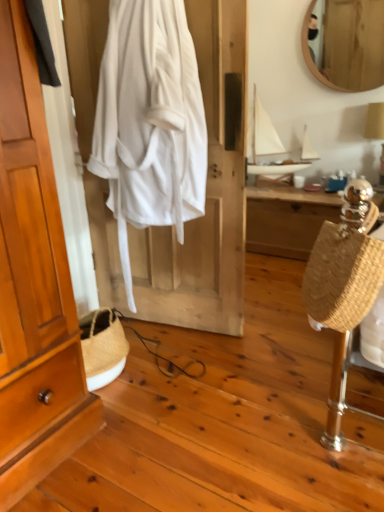
This screenshot has width=384, height=512. Describe the element at coordinates (343, 274) in the screenshot. I see `braided straw bag at right` at that location.

Measure the distance between white cotton robe at center and camera.

A distance of 5.32 feet exists between white cotton robe at center and camera.

The height and width of the screenshot is (512, 384). I want to click on wooden mirror at upper right, so click(x=350, y=45).

In order to face white matte sailboat at upper center, should I rotate leftwards or rightwards?

To face it directly, rotate right by 11.442 degrees.

What are the coordinates of `braided straw bag at right` in the screenshot? It's located at (343, 274).

Considering the sizes of objects wooden wardrobe at left and wooden mirror at upper right in the image provided, who is smaller, wooden wardrobe at left or wooden mirror at upper right?

wooden wardrobe at left.

Is wooden mirror at upper right inside wooden wardrobe at left?

That's incorrect, wooden mirror at upper right is not inside wooden wardrobe at left.

This screenshot has width=384, height=512. I want to click on cabinetry in front of the wooden mirror at upper right, so click(34, 285).

Considering the sizes of wooden desk at center and braided straw bag at right in the image, is wooden desk at center bigger or smaller than braided straw bag at right?

Considering their sizes, wooden desk at center takes up more space than braided straw bag at right.

How much distance is there between wooden desk at center and braided straw bag at right?

wooden desk at center is 1.69 meters away from braided straw bag at right.

Is wooden desk at center positioned in front of braided straw bag at right?

No, wooden desk at center is behind braided straw bag at right.

Is braided straw bag at right at the back of wooden desk at center?

No, wooden desk at center's orientation is not away from braided straw bag at right.

Considering the positions of objects wooden wardrobe at left and braided straw bag at right in the image provided, who is more to the right, wooden wardrobe at left or braided straw bag at right?

From the viewer's perspective, braided straw bag at right appears more on the right side.

Is wooden wardrobe at left not within braided straw bag at right?

Yes.

From a real-world perspective, is wooden wardrobe at left beneath braided straw bag at right?

No, from a real-world perspective, wooden wardrobe at left is not below braided straw bag at right.

Which object is closer to the camera taking this photo, wooden wardrobe at left or white cotton robe at center?

wooden wardrobe at left.

Is wooden wardrobe at left positioned far away from white cotton robe at center?

That's not correct — wooden wardrobe at left is a little close to white cotton robe at center.

In the scene shown: Is wooden wardrobe at left smaller than white cotton robe at center?

Correct, wooden wardrobe at left occupies less space than white cotton robe at center.

Is point (70, 447) positioned before point (167, 183)?

Yes, point (70, 447) is closer to viewer.

Are white matte sailboat at upper center and white cotton robe at center beside each other?

No, white matte sailboat at upper center is not touching white cotton robe at center.

Is white matte sailboat at upper center to the right of white cotton robe at center from the viewer's perspective?

Yes.

Is the position of white matte sailboat at upper center more distant than that of white cotton robe at center?

Yes, white matte sailboat at upper center is behind white cotton robe at center.

How different are the orientations of white matte sailboat at upper center and white cotton robe at center in degrees?

The angular difference between white matte sailboat at upper center and white cotton robe at center is 11.9 degrees.

Is white matte sailboat at upper center at the left side of wooden wardrobe at left?

No.

Based on their sizes in the image, would you say white matte sailboat at upper center is bigger or smaller than wooden wardrobe at left?

white matte sailboat at upper center is bigger than wooden wardrobe at left.

Which is correct: white matte sailboat at upper center is inside wooden wardrobe at left, or outside of it?

white matte sailboat at upper center is spatially situated outside wooden wardrobe at left.

Is wooden desk at center surrounding white cotton robe at center?

That's incorrect, white cotton robe at center is not inside wooden desk at center.

From the picture: Is wooden desk at center positioned with its back to white cotton robe at center?

No, wooden desk at center's orientation is not away from white cotton robe at center.

Does wooden desk at center have a greater height compared to white cotton robe at center?

Incorrect, the height of wooden desk at center is not larger of that of white cotton robe at center.

From a real-world perspective, which object rests below the other?

wooden desk at center, from a real-world perspective.

The width and height of the screenshot is (384, 512). In order to click on mirror behind the wooden wardrobe at left in this screenshot , I will do `click(350, 45)`.

In the image, there is a wooden desk at center. Find the location of `handbag below it (from the image's perspective)`. handbag below it (from the image's perspective) is located at coordinates (343, 274).

Considering their positions, is wooden mirror at upper right positioned further to wooden desk at center than braided straw bag at right?

braided straw bag at right is further to wooden desk at center.

Estimate the real-world distances between objects in this image. Which object is closer to white matte sailboat at upper center, wooden mirror at upper right or white cotton robe at center?

Based on the image, wooden mirror at upper right appears to be nearer to white matte sailboat at upper center.

Looking at the image, which one is located further to white cotton robe at center, white matte sailboat at upper center or braided straw bag at right?

The object further to white cotton robe at center is white matte sailboat at upper center.

Considering their positions, is white matte sailboat at upper center positioned further to wooden mirror at upper right than wooden wardrobe at left?

wooden wardrobe at left.

From the image, which object appears to be nearer to wooden wardrobe at left, white matte sailboat at upper center or wooden desk at center?

Based on the image, wooden desk at center appears to be nearer to wooden wardrobe at left.

Based on the photo, estimate the real-world distances between objects in this image. Which object is closer to wooden wardrobe at left, wooden desk at center or white cotton robe at center?

white cotton robe at center lies closer to wooden wardrobe at left than the other object.

Based on their spatial positions, is braided straw bag at right or wooden desk at center further from wooden wardrobe at left?

Among the two, wooden desk at center is located further to wooden wardrobe at left.

When comparing their distances from wooden wardrobe at left, does white cotton robe at center or braided straw bag at right seem further?

Among the two, braided straw bag at right is located further to wooden wardrobe at left.

Where is `cabinetry between braided straw bag at right and wooden mirror at upper right from front to back`? Image resolution: width=384 pixels, height=512 pixels. cabinetry between braided straw bag at right and wooden mirror at upper right from front to back is located at coordinates click(34, 285).

Locate an element on the screen. Image resolution: width=384 pixels, height=512 pixels. clothing located between braided straw bag at right and wooden desk at center in the depth direction is located at coordinates (149, 122).

What are the coordinates of `desk between braided straw bag at right and white matte sailboat at upper center along the z-axis` in the screenshot? It's located at (287, 219).

Where is `desk located between white cotton robe at center and white matte sailboat at upper center in the depth direction`? desk located between white cotton robe at center and white matte sailboat at upper center in the depth direction is located at coordinates (287, 219).